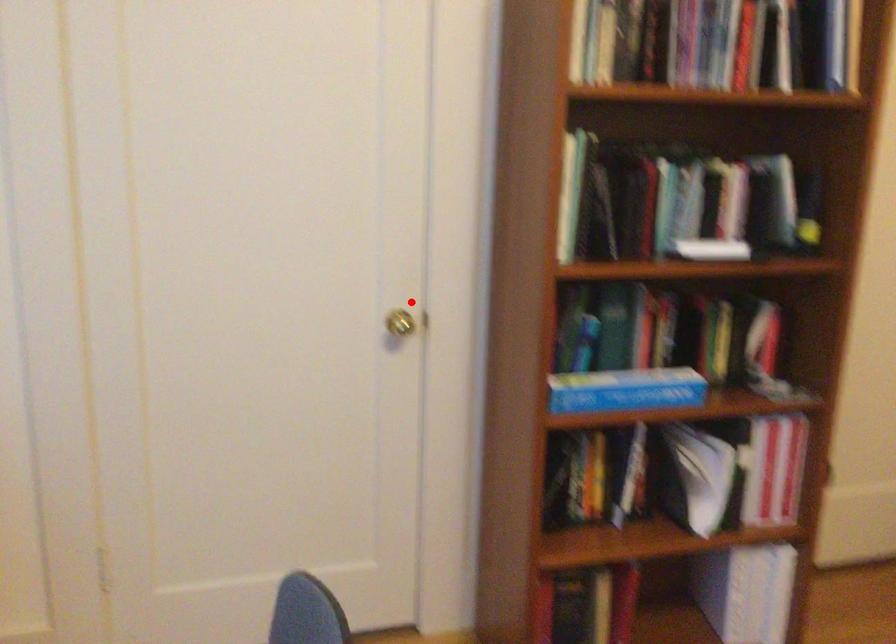
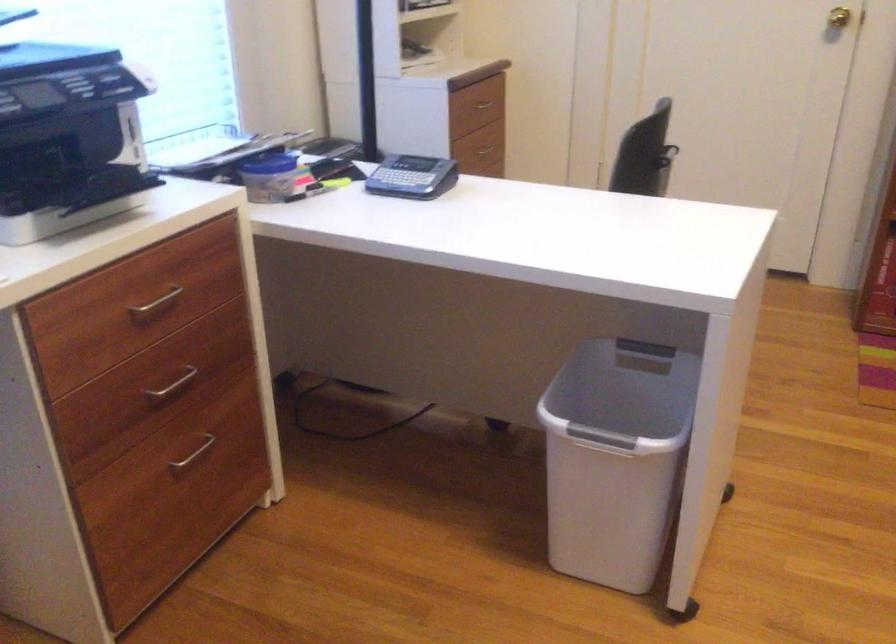
The point at the highlighted location is marked in the first image. Where is the corresponding point in the second image?

(839, 17)